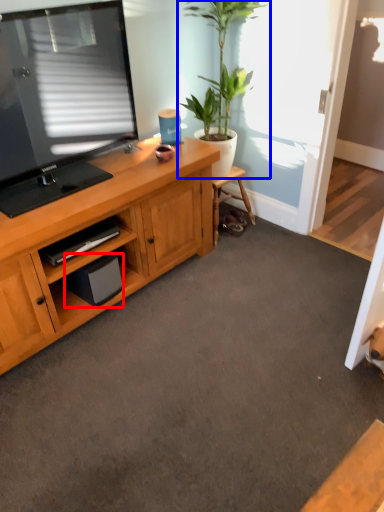
Question: Which object is closer to the camera taking this photo, speaker (highlighted by a red box) or houseplant (highlighted by a blue box)?

Choices:
 (A) speaker
 (B) houseplant

Answer: (B)